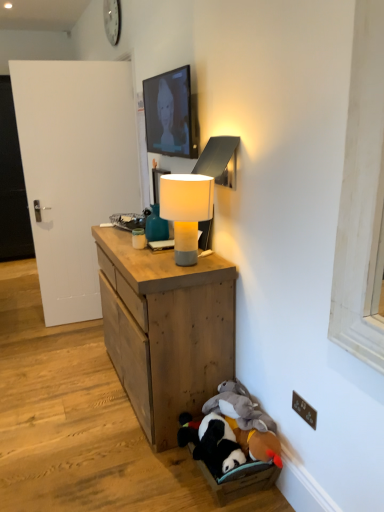
Question: From a real-world perspective, relative to matte black tv at upper center, is wooden cabinet at center vertically above or below?

Choices:
 (A) above
 (B) below

Answer: (B)

Question: In the image, is wooden cabinet at center on the left side or the right side of matte black tv at upper center?

Choices:
 (A) left
 (B) right

Answer: (A)

Question: Estimate the real-world distances between objects in this image. Which object is closer to the white plastic clock at upper center?

Choices:
 (A) white matte lamp at center
 (B) white matte door at left, which ranks as the 2th door in front-to-back order
 (C) brown plastic electric outlet at lower right
 (D) soft plush toys at lower right
 (E) wooden cabinet at center

Answer: (B)

Question: Estimate the real-world distances between objects in this image. Which object is farther from the soft plush toys at lower right?

Choices:
 (A) white matte door at left, acting as the 2th door starting from the right
 (B) matte black tv at upper center
 (C) white matte lamp at center
 (D) white plastic clock at upper center
 (E) brown plastic electric outlet at lower right

Answer: (A)